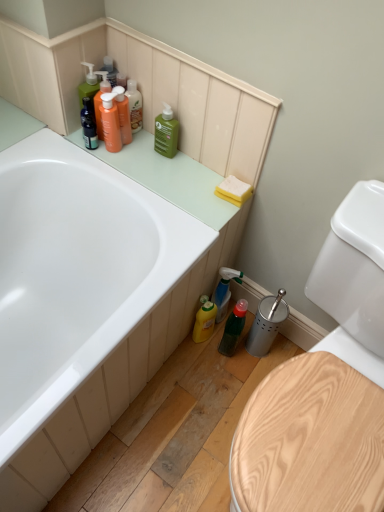
Identify the location of free location in front of yellow sponge at upper right. The height and width of the screenshot is (512, 384). pos(206,223).